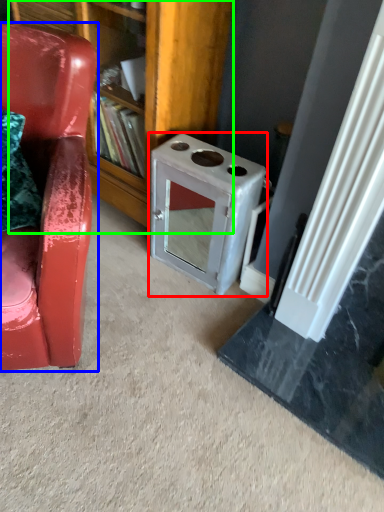
Question: Considering the real-world distances, which object is closest to appliance (highlighted by a red box)? chair (highlighted by a blue box) or bookshelf (highlighted by a green box).

Choices:
 (A) chair
 (B) bookshelf

Answer: (B)